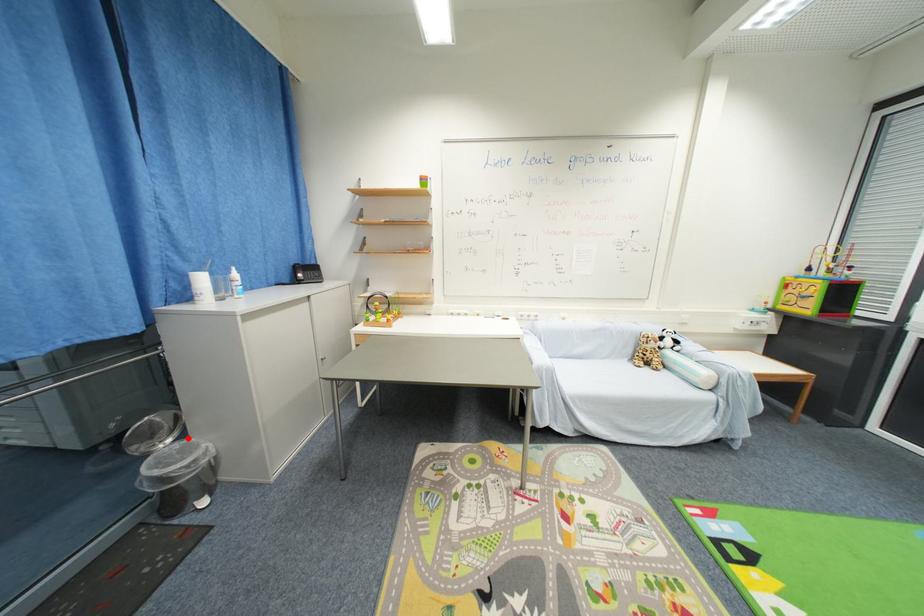
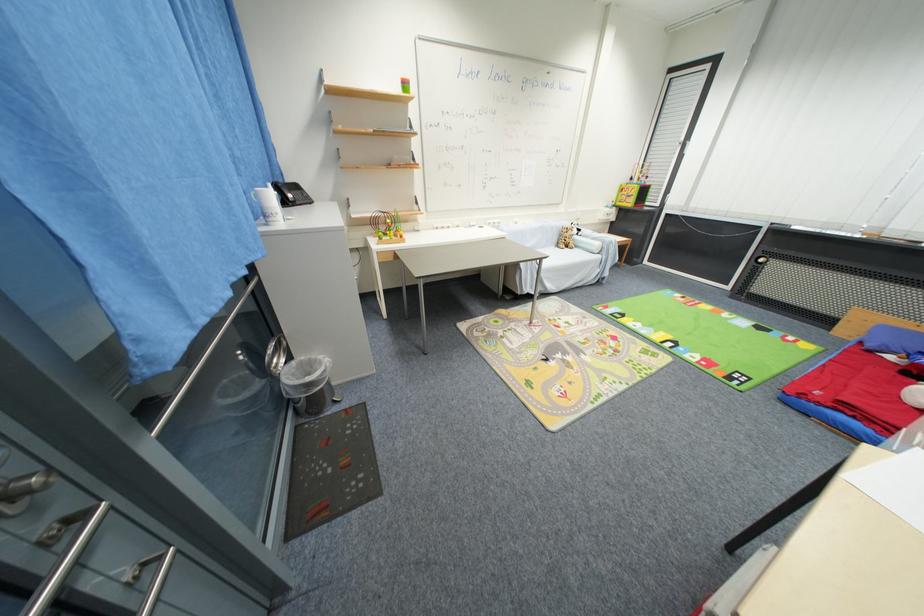
Where in the second image is the point corresponding to the highlighted location from the first image?

(295, 360)